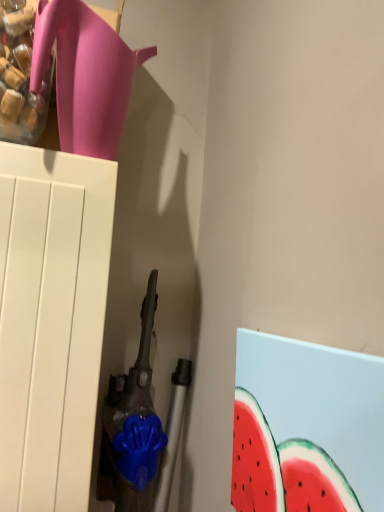
Describe the element at coordinates (85, 75) in the screenshot. Image resolution: width=384 pixels, height=512 pixels. I see `matte pink jug at upper left` at that location.

Where is `matte pink jug at upper left`? The width and height of the screenshot is (384, 512). matte pink jug at upper left is located at coordinates (85, 75).

What do you see at coordinates (281, 468) in the screenshot? This screenshot has height=512, width=384. I see `watermelon painted canvas at lower right` at bounding box center [281, 468].

Identify the location of watermelon painted canvas at lower right. The image size is (384, 512). (281, 468).

Where is `matte pink jug at upper left`? The width and height of the screenshot is (384, 512). matte pink jug at upper left is located at coordinates (85, 75).

Which object is positioned more to the left, matte pink jug at upper left or watermelon painted canvas at lower right?

From the viewer's perspective, matte pink jug at upper left appears more on the left side.

Is matte pink jug at upper left further to the viewer compared to watermelon painted canvas at lower right?

Yes, matte pink jug at upper left is further from the camera.

Does point (58, 40) come farther from viewer compared to point (332, 462)?

Yes, it is.

Based on the photo, from the image's perspective, is matte pink jug at upper left on top of watermelon painted canvas at lower right?

Indeed, from the image's perspective, matte pink jug at upper left is shown above watermelon painted canvas at lower right.

From a real-world perspective, is matte pink jug at upper left on top of watermelon painted canvas at lower right?

Yes, from a real-world perspective, matte pink jug at upper left is over watermelon painted canvas at lower right

Between matte pink jug at upper left and watermelon painted canvas at lower right, which one has smaller width?

watermelon painted canvas at lower right.

Considering the sizes of objects matte pink jug at upper left and watermelon painted canvas at lower right in the image provided, who is shorter, matte pink jug at upper left or watermelon painted canvas at lower right?

matte pink jug at upper left.

Between matte pink jug at upper left and watermelon painted canvas at lower right, which one has larger size?

Bigger between the two is matte pink jug at upper left.

Is matte pink jug at upper left located outside watermelon painted canvas at lower right?

That's correct, matte pink jug at upper left is outside of watermelon painted canvas at lower right.

Are matte pink jug at upper left and watermelon painted canvas at lower right beside each other?

No, matte pink jug at upper left is not in contact with watermelon painted canvas at lower right.

Is matte pink jug at upper left oriented away from watermelon painted canvas at lower right?

No, matte pink jug at upper left's orientation is not away from watermelon painted canvas at lower right.

Measure the distance between matte pink jug at upper left and watermelon painted canvas at lower right.

matte pink jug at upper left and watermelon painted canvas at lower right are 22.47 inches apart.

This screenshot has width=384, height=512. I want to click on watermelon that is below the matte pink jug at upper left (from the image's perspective), so click(281, 468).

In the scene shown: Which object is positioned more to the right, watermelon painted canvas at lower right or matte pink jug at upper left?

Positioned to the right is watermelon painted canvas at lower right.

Is the position of watermelon painted canvas at lower right more distant than that of matte pink jug at upper left?

No.

Which is behind, point (276, 477) or point (116, 142)?

Point (116, 142)

From the image's perspective, is watermelon painted canvas at lower right above or below matte pink jug at upper left?

Clearly, from the image's perspective, watermelon painted canvas at lower right is below matte pink jug at upper left.

From a real-world perspective, is watermelon painted canvas at lower right physically above matte pink jug at upper left?

No, from a real-world perspective, watermelon painted canvas at lower right is not on top of matte pink jug at upper left.

Between watermelon painted canvas at lower right and matte pink jug at upper left, which one has larger width?

matte pink jug at upper left.

Is watermelon painted canvas at lower right shorter than matte pink jug at upper left?

No, watermelon painted canvas at lower right is not shorter than matte pink jug at upper left.

Is watermelon painted canvas at lower right bigger than matte pink jug at upper left?

No.

Does watermelon painted canvas at lower right contain matte pink jug at upper left?

Actually, matte pink jug at upper left is outside watermelon painted canvas at lower right.

Is watermelon painted canvas at lower right touching matte pink jug at upper left?

watermelon painted canvas at lower right and matte pink jug at upper left are clearly separated.

Is matte pink jug at upper left at the back of watermelon painted canvas at lower right?

No, watermelon painted canvas at lower right's orientation is not away from matte pink jug at upper left.

Can you tell me how much watermelon painted canvas at lower right and matte pink jug at upper left differ in facing direction?

87.4 degrees.

The image size is (384, 512). What are the coordinates of `jug above the watermelon painted canvas at lower right (from a real-world perspective)` in the screenshot? It's located at (85, 75).

The width and height of the screenshot is (384, 512). What are the coordinates of `jug above the watermelon painted canvas at lower right (from the image's perspective)` in the screenshot? It's located at click(85, 75).

The width and height of the screenshot is (384, 512). I want to click on watermelon lying in front of the matte pink jug at upper left, so click(281, 468).